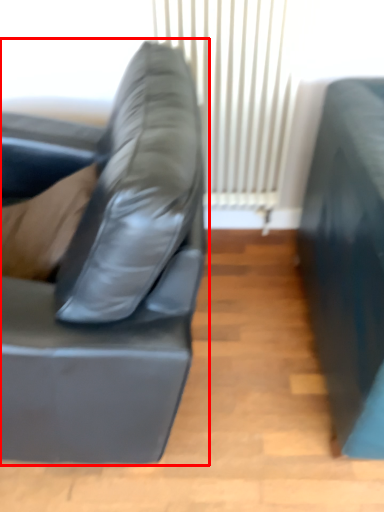
Question: From the image's perspective, what is the correct spatial positioning of studio couch (annotated by the red box) in reference to curtain?

Choices:
 (A) above
 (B) below

Answer: (B)